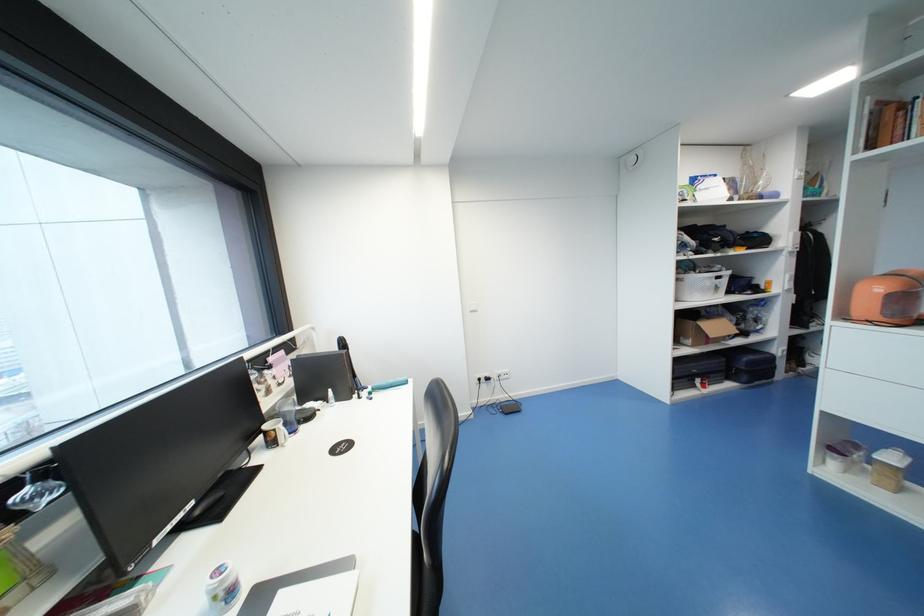
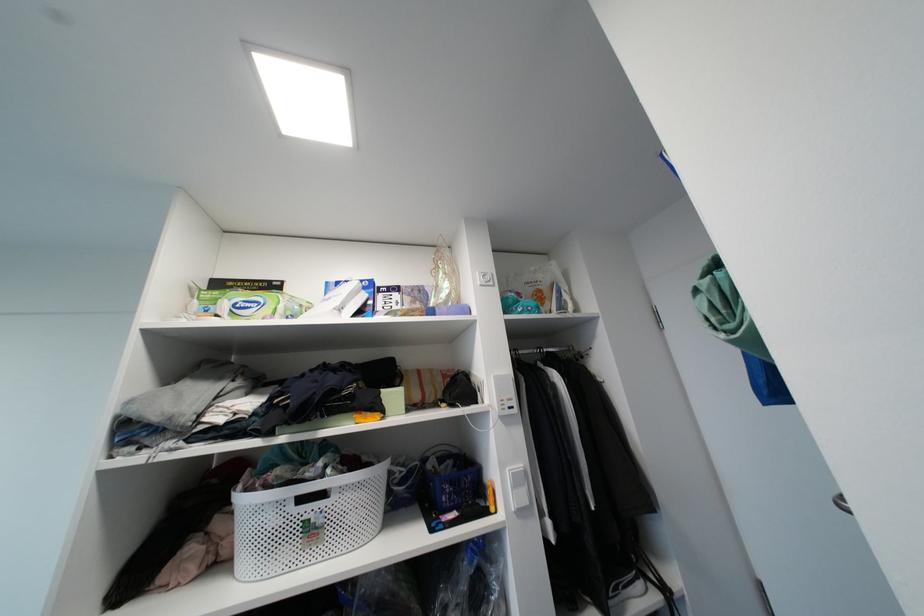
The images are taken continuously from a first-person perspective. In which direction are you moving?

The movement direction of the cameraman is right, forward.